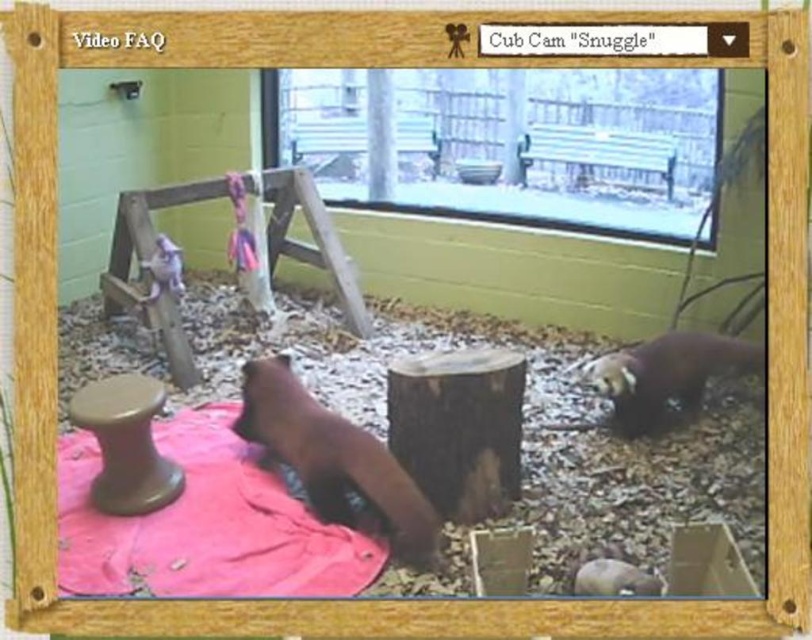
You are a wildlife researcher observing the Cub Cam Snuggle. You need to locate the pink fabric at lower left. According to the coordinates provided, where exactly is it positioned?

The pink fabric at lower left is located at point (205, 524).

You are a zookeeper responsible for the bears at the Cub Cam Snuggle exhibit. You need to place a new feeding tray that is 1.2 meters wide between the pink fabric at lower left and the brown furry bear at lower right. Is there enough space between them to fit the feeding tray?

The pink fabric at lower left has a larger size compared to brown furry bear at lower right, but the exact distance between them isn not specified in the provided information. Therefore, it is unclear if the 1.2 meter feeding tray will fit between them.

You are a zookeeper observing the Cub Cam Snuggle. You need to place a new feeding tray between the pink fabric at lower left and the matte brown stool at lower left. Based on their positions, which object should the feeding tray be closer to?

The feeding tray should be placed closer to the matte brown stool at lower left because the pink fabric at lower left is to the right of the matte brown stool at lower left, meaning the stool is on the left side and the fabric is on the right. Therefore, the tray should be placed between them with the stool being the closer one.